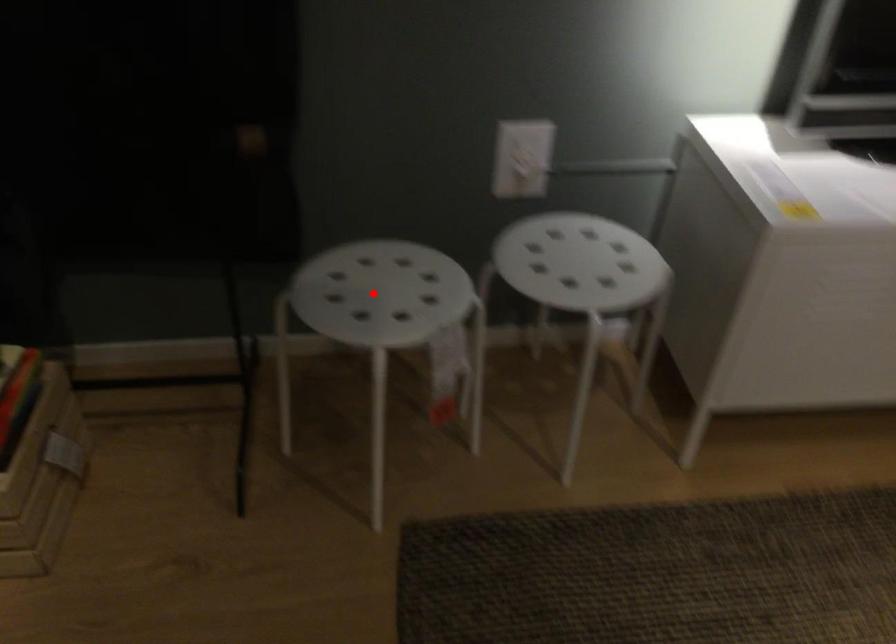
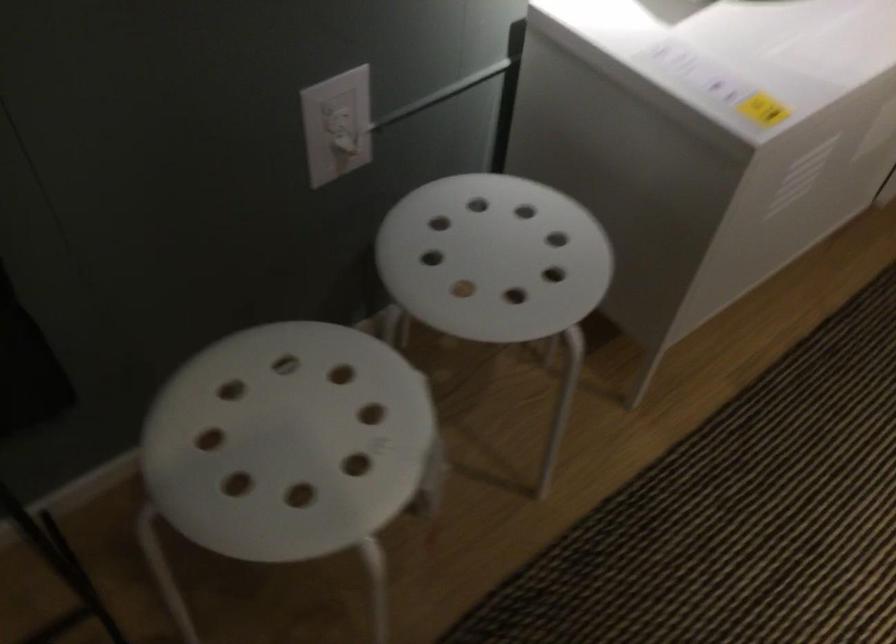
Question: I am providing you with two images of the same scene from different viewpoints. In image1, a red point is highlighted. Considering the same 3D point in image2, which of the following is correct?

Choices:
 (A) It is closer
 (B) It is farther

Answer: (A)